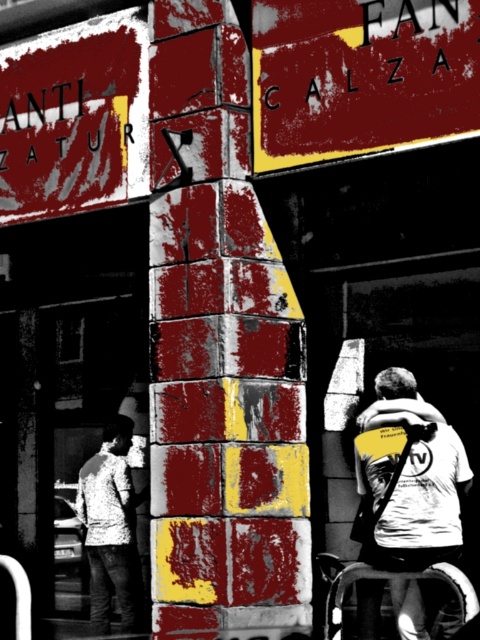
You are an urban explorer standing in front of a large column. You notice a point marked at coordinates (360, 76). What does this point indicate?

The point at (360, 76) marks the location of the matte yellow sign at upper center.